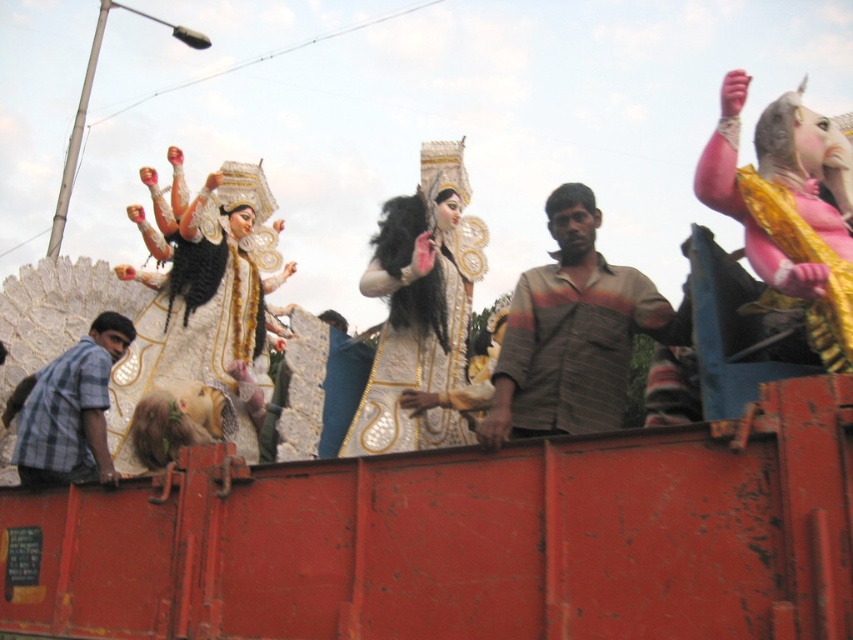
You are a photographer trying to capture the gold metallic statue at upper center and the pink fabric deity at upper right in a single shot. Based on their positions, which deity should you focus on first to ensure both are in frame?

The gold metallic statue at upper center is located below the pink fabric deity at upper right, so you should focus on the pink fabric deity at upper right first to ensure both are in frame.

You are a photographer trying to capture both the pink fabric deity at upper right and the checkered fabric shirt at left in the same frame. Based on their positions, which one should you focus on first to ensure both are in the frame?

The pink fabric deity at upper right is located above the checkered fabric shirt at left, so you should focus on the checkered fabric shirt at left first to ensure both are in the frame.